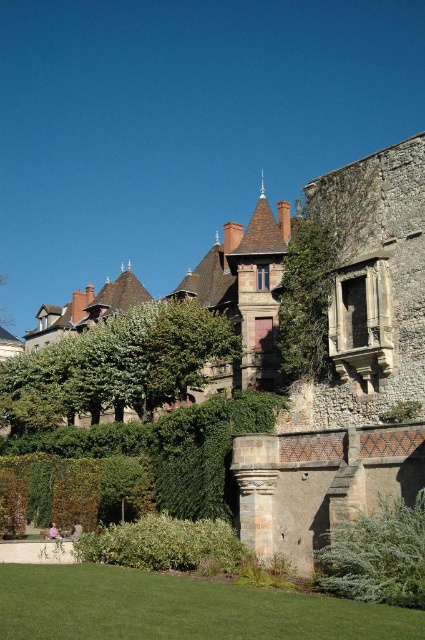
You are standing in the garden of the historic stone building. You want to walk from the green grass at lower center to the green leafy hedge at lower right. Which direction should you move relative to the hedge?

Since the green grass at lower center is in front of the green leafy hedge at lower right, you should move backward away from the hedge to reach the grass.

You are standing in the garden enclosed by the low stone wall with decorative brickwork at the top. You want to take a photo of the brown stone castle at upper center. In which direction should you walk to get a clear view of it?

The brown stone castle at upper center is located at point (350, 369) in the image, which is towards the upper part of the scene. To get a clear view, you should walk towards the upper direction from your current position in the garden.

What are the coordinates of the brown stone castle at upper center?

The brown stone castle at upper center is located at coordinates point (350, 369).